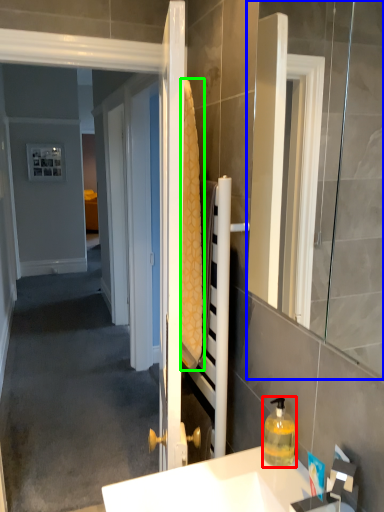
Question: Which is nearer to the bottle (highlighted by a red box)? mirror (highlighted by a blue box) or bath towel (highlighted by a green box).

Choices:
 (A) mirror
 (B) bath towel

Answer: (B)